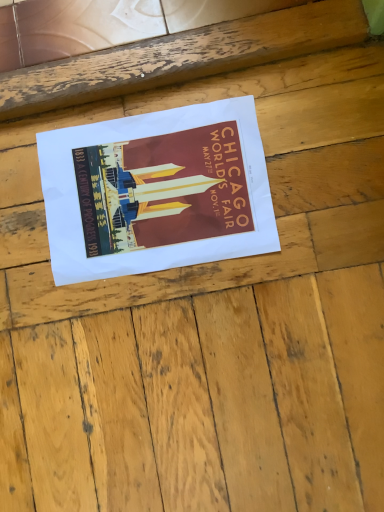
You are a GUI agent. You are given a task and a screenshot of the screen. Output one action in this format:
    pyautogui.click(x=<x>, y=<y>)
    Task: Click on the vacant space underneath matte paper poster at center (from a real-world perspective)
    
    Given the screenshot: What is the action you would take?
    pyautogui.click(x=154, y=195)